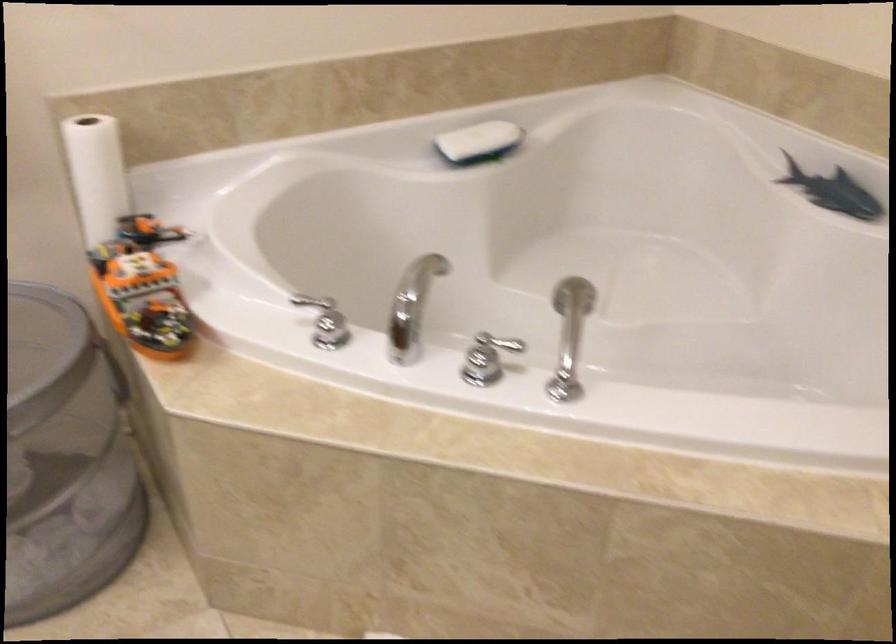
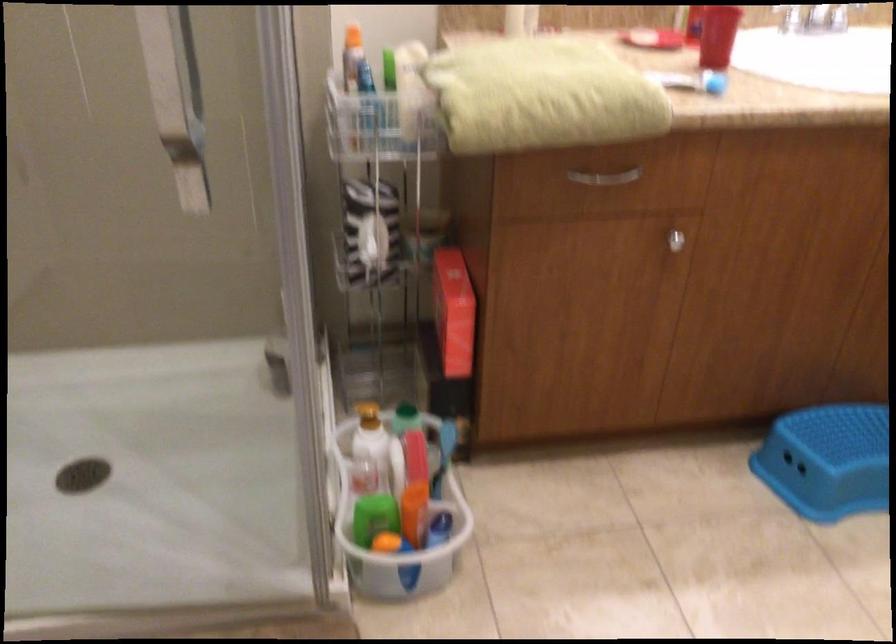
How did the camera likely rotate?

The camera rotated toward left-down.